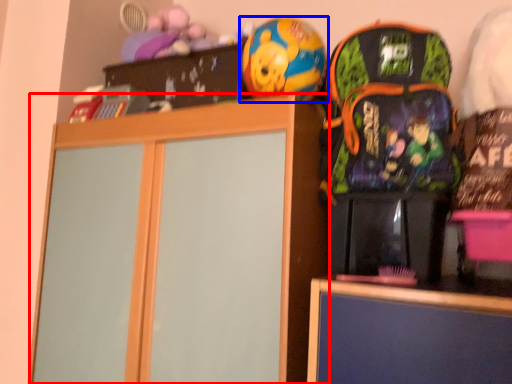
Question: Which of the following is the farthest to the observer, cabinetry (highlighted by a red box) or toy (highlighted by a blue box)?

Choices:
 (A) cabinetry
 (B) toy

Answer: (B)